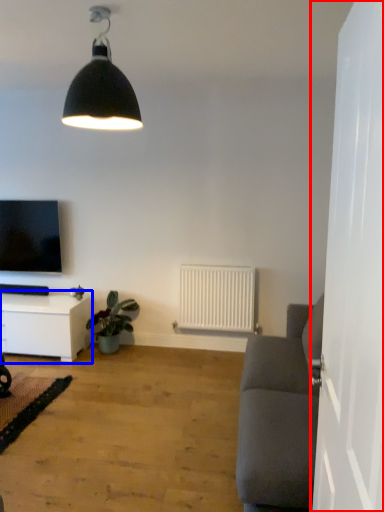
Question: Which object is further to the camera taking this photo, side (highlighted by a red box) or table (highlighted by a blue box)?

Choices:
 (A) side
 (B) table

Answer: (B)